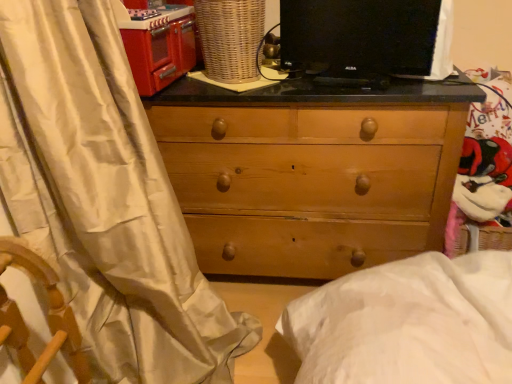
Question: Is shiny red oven at upper left oriented towards black glossy monitor at upper center?

Choices:
 (A) no
 (B) yes

Answer: (B)

Question: Can you confirm if shiny red oven at upper left is taller than black glossy monitor at upper center?

Choices:
 (A) no
 (B) yes

Answer: (B)

Question: Is black glossy monitor at upper center completely or partially inside shiny red oven at upper left?

Choices:
 (A) yes
 (B) no

Answer: (B)

Question: Can you confirm if shiny red oven at upper left is shorter than black glossy monitor at upper center?

Choices:
 (A) no
 (B) yes

Answer: (A)

Question: Is shiny red oven at upper left to the right of black glossy monitor at upper center from the viewer's perspective?

Choices:
 (A) no
 (B) yes

Answer: (A)

Question: From a real-world perspective, is shiny red oven at upper left positioned above or below natural wood chest of drawers at center?

Choices:
 (A) above
 (B) below

Answer: (A)

Question: From their relative heights in the image, would you say shiny red oven at upper left is taller or shorter than natural wood chest of drawers at center?

Choices:
 (A) short
 (B) tall

Answer: (A)

Question: Would you say shiny red oven at upper left is to the left or to the right of natural wood chest of drawers at center in the picture?

Choices:
 (A) right
 (B) left

Answer: (B)

Question: Is point (162, 21) closer or farther from the camera than point (398, 102)?

Choices:
 (A) farther
 (B) closer

Answer: (A)

Question: From a real-world perspective, is black glossy monitor at upper center above or below natural wood chest of drawers at center?

Choices:
 (A) above
 (B) below

Answer: (A)

Question: In the image, is black glossy monitor at upper center on the left side or the right side of natural wood chest of drawers at center?

Choices:
 (A) left
 (B) right

Answer: (B)

Question: Based on their sizes in the image, would you say black glossy monitor at upper center is bigger or smaller than natural wood chest of drawers at center?

Choices:
 (A) small
 (B) big

Answer: (A)

Question: Does point (418, 11) appear closer or farther from the camera than point (147, 102)?

Choices:
 (A) farther
 (B) closer

Answer: (B)

Question: Based on their positions, is natural wood chest of drawers at center located to the left or right of shiny red oven at upper left?

Choices:
 (A) left
 (B) right

Answer: (B)

Question: Looking at the image, does natural wood chest of drawers at center seem bigger or smaller compared to shiny red oven at upper left?

Choices:
 (A) big
 (B) small

Answer: (A)